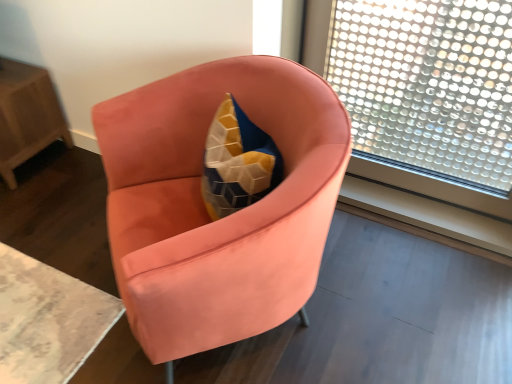
Question: Visually, is transparent glass window at upper right positioned to the left or to the right of wooden table at left?

Choices:
 (A) right
 (B) left

Answer: (A)

Question: Is point (443, 104) positioned closer to the camera than point (3, 74)?

Choices:
 (A) closer
 (B) farther

Answer: (A)

Question: Which is farther from the transparent glass window at upper right?

Choices:
 (A) wooden table at left
 (B) satin coral armchair at center

Answer: (A)

Question: Which is nearer to the wooden table at left?

Choices:
 (A) satin coral armchair at center
 (B) transparent glass window at upper right

Answer: (A)